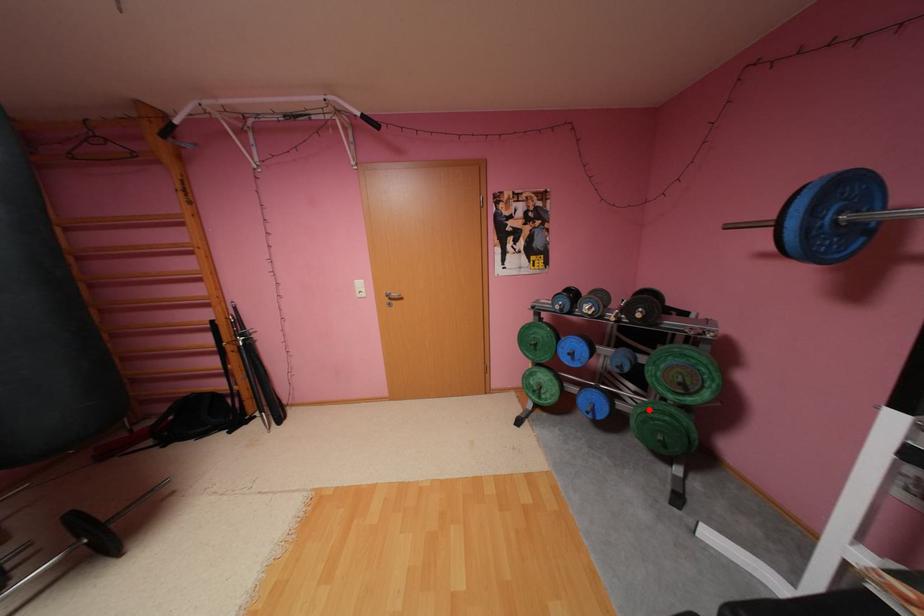
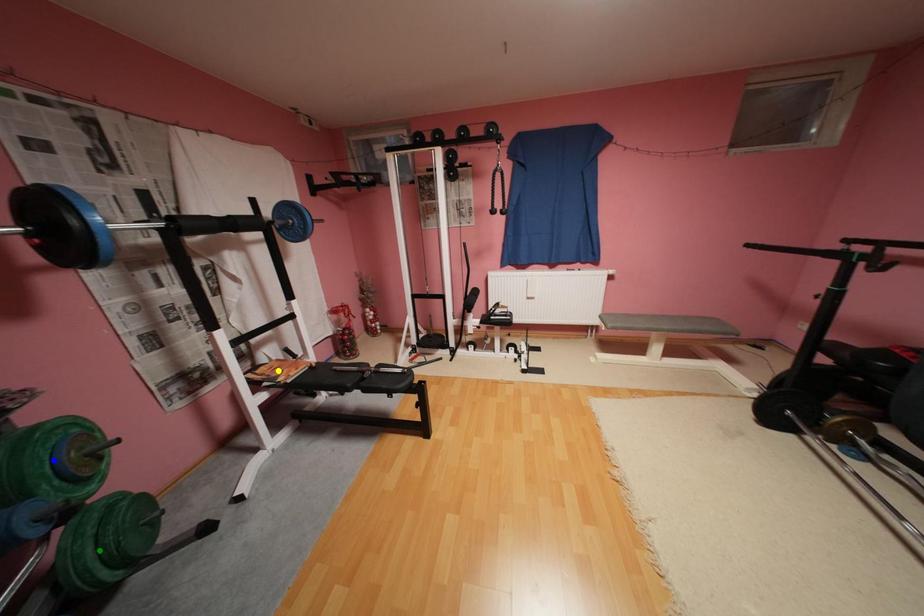
Question: I am providing you with two images of the same scene from different viewpoints. A red point is marked on the first image. You are given multiple points on the second image. Which spot in image 2 lines up with the point in image 1?

Choices:
 (A) green point
 (B) blue point
 (C) yellow point

Answer: (A)